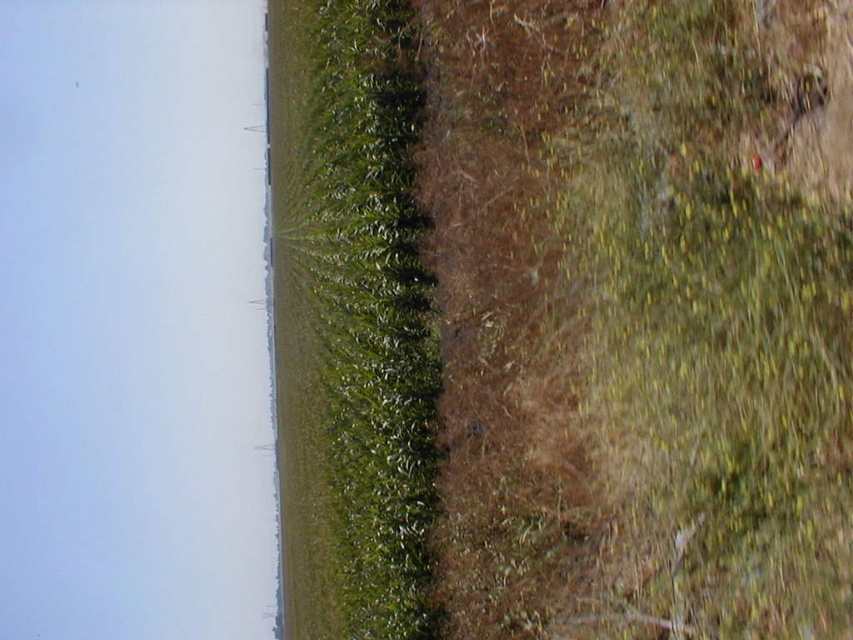
Question: Which object appears closest to the camera in this image?

Choices:
 (A) green leafy grass at center
 (B) green grass at center

Answer: (B)

Question: Does green grass at center appear on the right side of green leafy grass at center?

Choices:
 (A) yes
 (B) no

Answer: (A)

Question: Does green grass at center lie behind green leafy grass at center?

Choices:
 (A) no
 (B) yes

Answer: (A)

Question: Among these objects, which one is nearest to the camera?

Choices:
 (A) green grass at center
 (B) green leafy grass at center

Answer: (A)

Question: Is the position of green grass at center less distant than that of green leafy grass at center?

Choices:
 (A) no
 (B) yes

Answer: (B)

Question: Among these objects, which one is farthest from the camera?

Choices:
 (A) green leafy grass at center
 (B) green grass at center

Answer: (A)